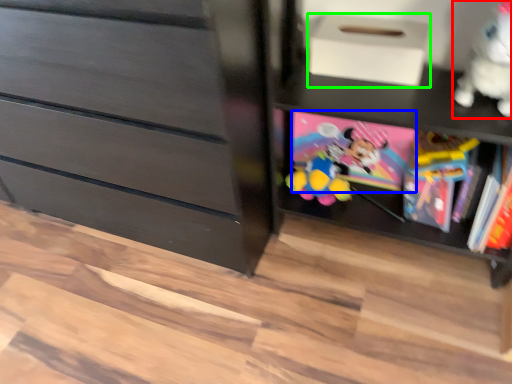
Question: Which object is the farthest from toy (highlighted by a red box)? Choose among these: book (highlighted by a blue box) or shoe box (highlighted by a green box).

Choices:
 (A) book
 (B) shoe box

Answer: (A)